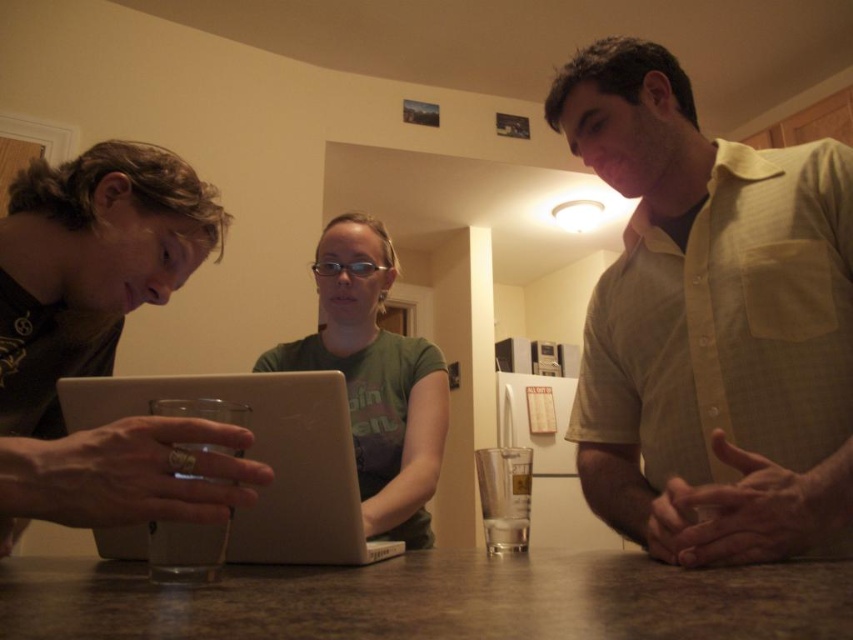
Question: Does white matte laptop at center appear on the left side of green matte shirt at center?

Choices:
 (A) yes
 (B) no

Answer: (A)

Question: Does light yellow button-down shirt at right appear over white matte laptop at center?

Choices:
 (A) no
 (B) yes

Answer: (B)

Question: Which point appears farthest from the camera in this image?

Choices:
 (A) (703, 579)
 (B) (577, 115)
 (C) (4, 269)

Answer: (B)

Question: Observing the image, what is the correct spatial positioning of brown laminate table at center in reference to white matte laptop at center?

Choices:
 (A) right
 (B) left

Answer: (A)

Question: Estimate the real-world distances between objects in this image. Which object is farther from the matte black laptop at left?

Choices:
 (A) brown laminate table at center
 (B) green matte shirt at center
 (C) white matte laptop at center

Answer: (B)

Question: Which point appears closest to the camera in this image?

Choices:
 (A) (22, 380)
 (B) (155, 609)
 (C) (387, 512)

Answer: (B)